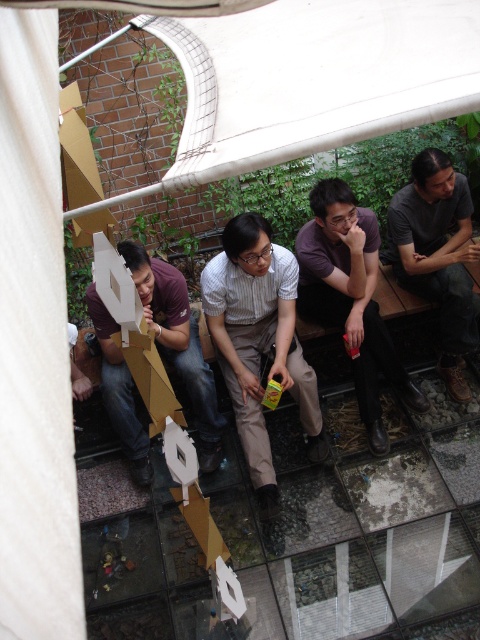
Question: Is purple matte shirt at center smaller than matte cardboard box at lower left?

Choices:
 (A) no
 (B) yes

Answer: (A)

Question: Which of these objects is positioned closest to the dark gray shirt at right?

Choices:
 (A) purple matte shirt at center
 (B) white fabric canopy at upper center

Answer: (A)

Question: Which point appears closest to the camera in this image?

Choices:
 (A) pyautogui.click(x=173, y=291)
 (B) pyautogui.click(x=208, y=269)
 (C) pyautogui.click(x=372, y=444)
 (D) pyautogui.click(x=462, y=44)

Answer: (D)

Question: In this image, where is white fabric canopy at upper center located relative to dark gray shirt at right?

Choices:
 (A) above
 (B) below

Answer: (A)

Question: Is white fabric canopy at upper center thinner than striped cotton shirt at center?

Choices:
 (A) yes
 (B) no

Answer: (B)

Question: Estimate the real-world distances between objects in this image. Which object is farther from the dark gray shirt at right?

Choices:
 (A) striped cotton shirt at center
 (B) white fabric canopy at upper center

Answer: (B)